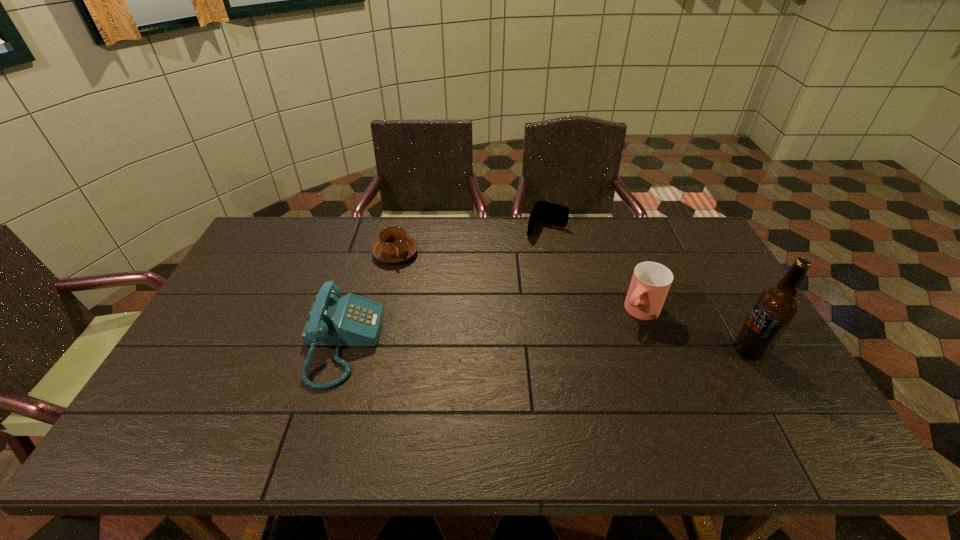
Identify the location of vacant space in between the cappuccino and the third shortest object. The image size is (960, 540). (369, 298).

This screenshot has height=540, width=960. I want to click on free area in between the farthest object and the cup, so click(x=593, y=270).

The width and height of the screenshot is (960, 540). In order to click on free space between the farthest object and the fourth nearest object in this screenshot , I will do `click(471, 241)`.

The width and height of the screenshot is (960, 540). Identify the location of free space between the fourth nearest object and the wallet. (471, 241).

Identify the location of vacant point located between the tallest object and the cappuccino. (572, 302).

I want to click on vacant space that is in between the rightmost object and the fourth nearest object, so coord(572,302).

This screenshot has width=960, height=540. Identify the location of free spot between the rightmost object and the fourth object from left to right. (694, 330).

Where is `vacant region between the fourth nearest object and the telephone`? The width and height of the screenshot is (960, 540). vacant region between the fourth nearest object and the telephone is located at coordinates pyautogui.click(x=369, y=298).

Where is `free space that is in between the second farthest object and the third shortest object`? Image resolution: width=960 pixels, height=540 pixels. free space that is in between the second farthest object and the third shortest object is located at coordinates point(369,298).

Select which object is the second closest to the third object from left to right. Please provide its 2D coordinates. Your answer should be formatted as a tuple, i.e. [(x, y)], where the tuple contains the x and y coordinates of a point satisfying the conditions above.

[(394, 245)]